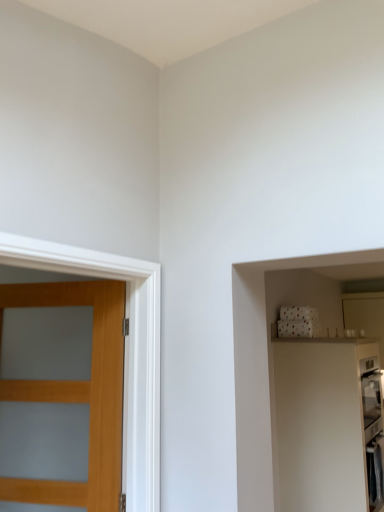
What do you see at coordinates (78, 393) in the screenshot? I see `light brown wooden door at left` at bounding box center [78, 393].

Find the location of `light brown wooden door at left`. light brown wooden door at left is located at coordinates (78, 393).

The height and width of the screenshot is (512, 384). Find the location of `light brown wooden door at left`. light brown wooden door at left is located at coordinates coord(78,393).